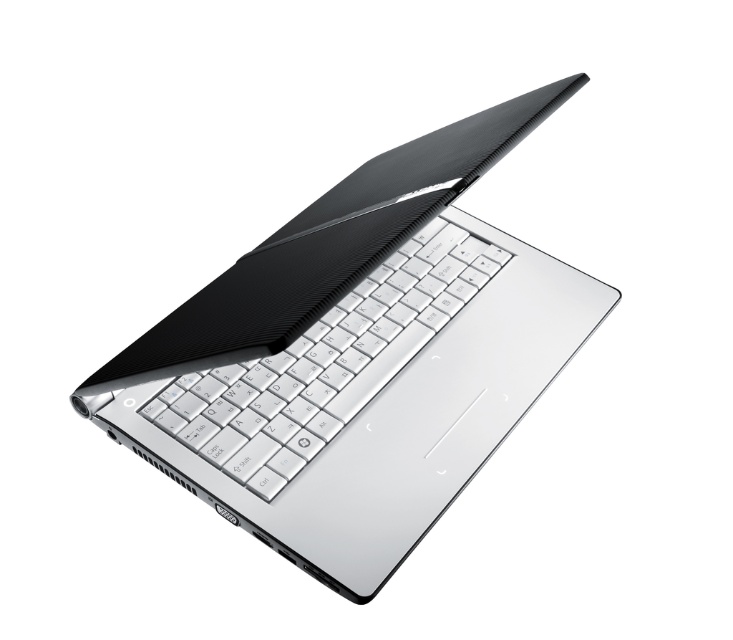
Based on the photo, you are setting up a desk for a presentation and need to ensure the silver metallic laptop at center and the white matte keyboard at center are arranged properly. According to the image, which object is positioned higher on the desk?

The silver metallic laptop at center is located above the white matte keyboard at center, so it is positioned higher on the desk.

You are a delivery robot trying to navigate to the display area of the laptop. You can see two points marked in the image. The first point is at coordinate point(380, 177) and the second is at point(323, 353). Which point should you move towards to reach the display area first?

Point(380, 177) is in front of point(323, 353), so you should move towards point(380, 177) first to reach the display area.